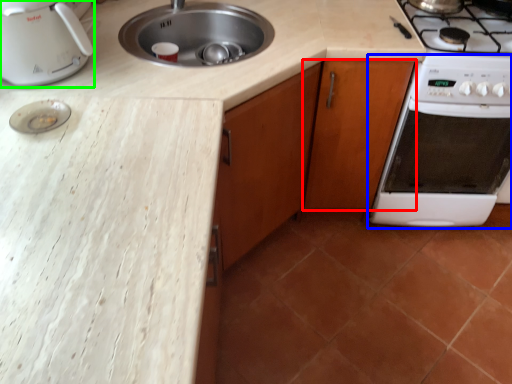
Question: Which is farther away from cabinetry (highlighted by a red box)? oven (highlighted by a blue box) or kitchen appliance (highlighted by a green box)?

Choices:
 (A) oven
 (B) kitchen appliance

Answer: (B)